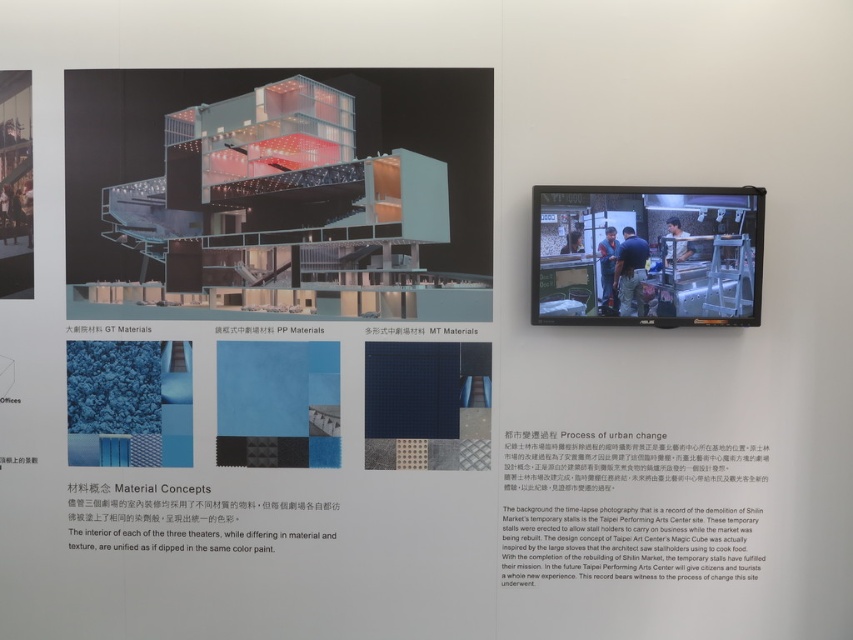
Question: From the image, what is the correct spatial relationship of blue jeans at center in relation to blue uniform at center?

Choices:
 (A) left
 (B) right

Answer: (B)

Question: Which point is farther to the camera?

Choices:
 (A) blue fabric shirt at upper center
 (B) blue uniform at center
 (C) blue jeans at center

Answer: (B)

Question: Does blue uniform at center lie in front of blue fabric at upper center?

Choices:
 (A) no
 (B) yes

Answer: (B)

Question: Which of the following is the closest to the observer?

Choices:
 (A) blue fabric at upper center
 (B) blue jeans at center
 (C) blue uniform at center
 (D) blue fabric shirt at upper center

Answer: (D)

Question: Estimate the real-world distances between objects in this image. Which object is farther from the blue fabric shirt at upper center?

Choices:
 (A) blue uniform at center
 (B) blue fabric at upper center

Answer: (B)

Question: Can you confirm if blue jeans at center is smaller than blue uniform at center?

Choices:
 (A) no
 (B) yes

Answer: (A)